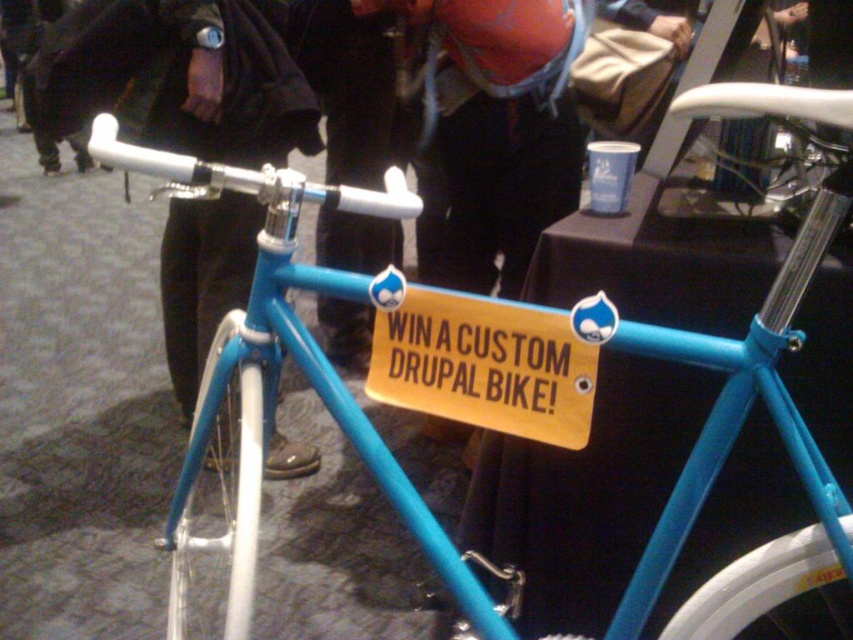
Question: Among these objects, which one is nearest to the camera?

Choices:
 (A) yellow paper sign at center
 (B) matte black jacket at center

Answer: (A)

Question: Is matte black jacket at center above yellow paper sign at center?

Choices:
 (A) no
 (B) yes

Answer: (B)

Question: Does matte black jacket at center appear over yellow paper sign at center?

Choices:
 (A) no
 (B) yes

Answer: (B)

Question: Can you confirm if matte black jacket at center is bigger than yellow paper sign at center?

Choices:
 (A) yes
 (B) no

Answer: (A)

Question: Among these points, which one is farthest from the camera?

Choices:
 (A) (241, 147)
 (B) (408, 320)

Answer: (A)